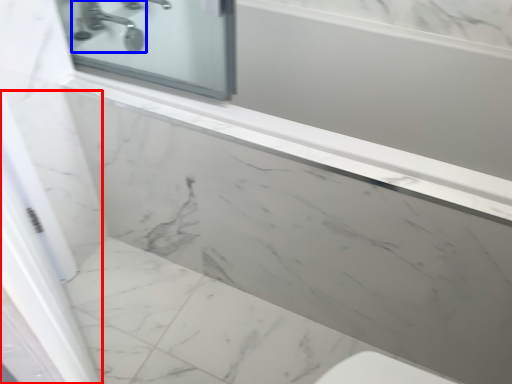
Question: Among these objects, which one is farthest to the camera, screen door (highlighted by a red box) or tap (highlighted by a blue box)?

Choices:
 (A) screen door
 (B) tap

Answer: (B)